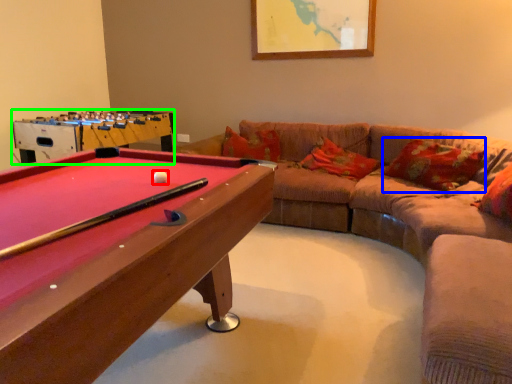
Question: Estimate the real-world distances between objects in this image. Which object is closer to ball (highlighted by a red box), pillow (highlighted by a blue box) or table (highlighted by a green box)?

Choices:
 (A) pillow
 (B) table

Answer: (B)